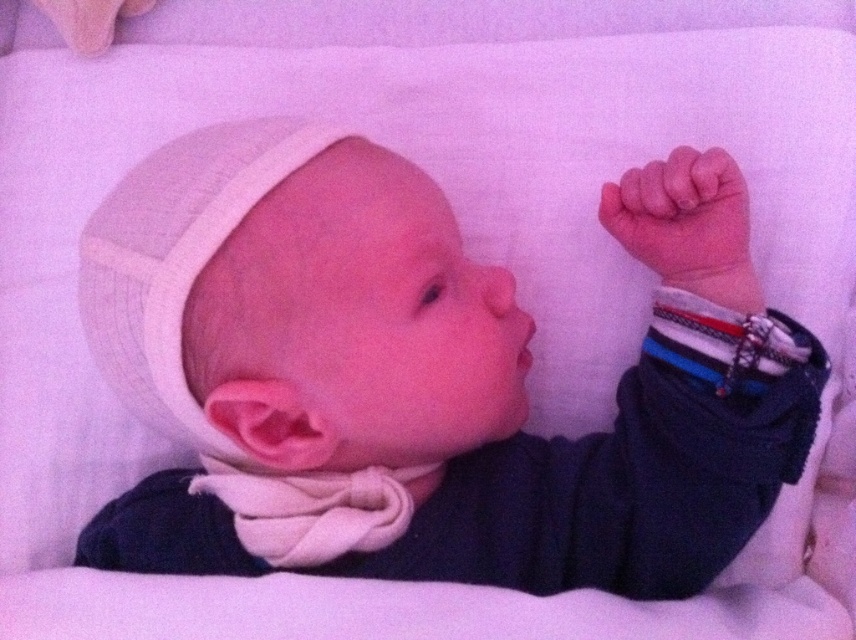
Can you confirm if white knit hat at upper left is thinner than rubber teething ring at upper right?

Incorrect, white knit hat at upper left's width is not less than rubber teething ring at upper right's.

Is point (293, 560) behind point (675, 204)?

No, it is in front of (675, 204).

I want to click on white knit hat at upper left, so click(x=425, y=378).